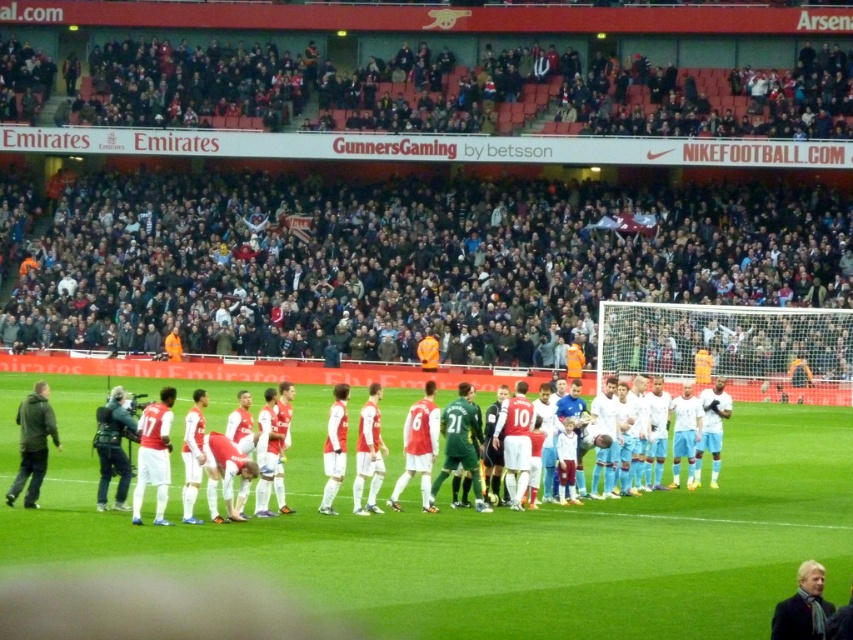
Between white smooth soccer field at center and dark green jacket at left, which one appears on the right side from the viewer's perspective?

white smooth soccer field at center is more to the right.

Who is positioned more to the left, white smooth soccer field at center or dark green jacket at left?

Positioned to the left is dark green jacket at left.

Locate an element on the screen. The width and height of the screenshot is (853, 640). white smooth soccer field at center is located at coordinates (498, 538).

Where is `white smooth soccer field at center`? The width and height of the screenshot is (853, 640). white smooth soccer field at center is located at coordinates (498, 538).

Describe the element at coordinates (308, 436) in the screenshot. I see `white smooth soccer team at center` at that location.

Is white smooth soccer team at center above camouflage-patterned jacket at left?

Indeed, white smooth soccer team at center is positioned over camouflage-patterned jacket at left.

Is point (402, 390) behind point (109, 467)?

Yes, point (402, 390) is farther from viewer.

Locate an element on the screen. Image resolution: width=853 pixels, height=640 pixels. white smooth soccer team at center is located at coordinates (308, 436).

The width and height of the screenshot is (853, 640). What do you see at coordinates (498, 538) in the screenshot?
I see `white smooth soccer field at center` at bounding box center [498, 538].

Is white smooth soccer field at center taller than camouflage-patterned jacket at left?

No, white smooth soccer field at center is not taller than camouflage-patterned jacket at left.

Who is more forward, (569, 506) or (115, 438)?

Point (115, 438) is in front.

Locate an element on the screen. The width and height of the screenshot is (853, 640). white smooth soccer field at center is located at coordinates (498, 538).